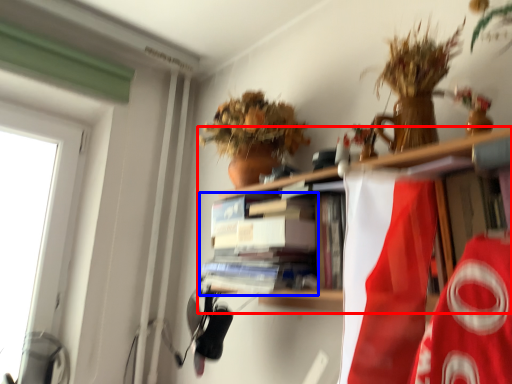
Question: Among these objects, which one is farthest to the camera, shelf (highlighted by a red box) or book (highlighted by a blue box)?

Choices:
 (A) shelf
 (B) book

Answer: (B)